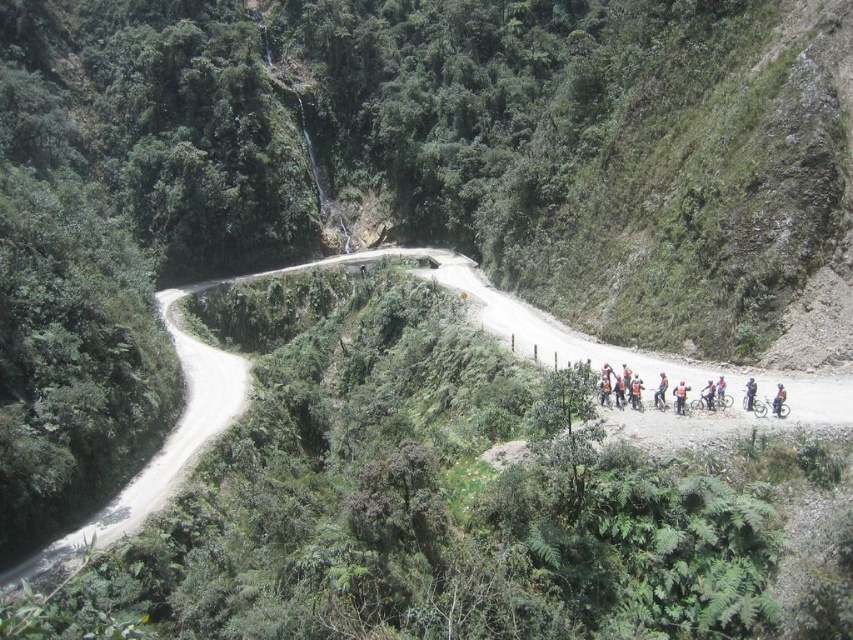
You are a photographer planning to capture a group photo of the orange fabric cyclist at center and the blue fabric helmet at center. Which object should you focus on to ensure it takes up more of the frame?

The blue fabric helmet at center should be focused on because it occupies more space than the orange fabric cyclist at center.

You are a hiker on the winding dirt road and see the orange fabric cyclist at center and the blue fabric helmet at center. Which one is farther away from you?

The blue fabric helmet at center is farther away because it is positioned behind the orange fabric cyclist at center.

You are a photographer planning to capture the orange fabric cyclist at center and the blue fabric helmet at center in a single shot. Since the camera lens has a limited field of view, you need to adjust your position to ensure both subjects are fully visible. Considering their sizes, which subject might require you to move closer to avoid being cut off?

The blue fabric helmet at center is thicker than the orange fabric cyclist at center, so you might need to move closer to ensure the blue fabric helmet at center fits within the frame without being cut off.